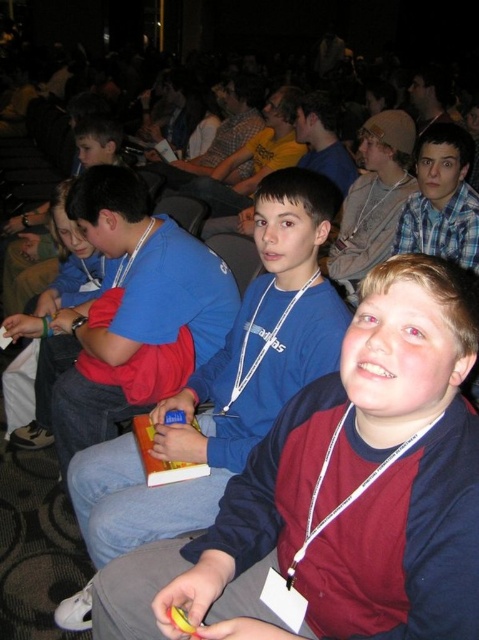
You are standing in the auditorium and want to take a photo of the point at coordinates point (305, 378). If your camera has a maximum focus range of 4 feet, will it be able to focus on that point?

The distance of point (305, 378) from the camera is 4.47 feet, which exceeds the camera maximum focus range of 4 feet. Therefore, the camera cannot focus on that point.

You are a photographer adjusting your camera settings. You need to ensure that both the blue fabric shirt at left and the blue denim jeans at center are in focus. Given their positions, which object is closer to the camera and might require adjusting the focus accordingly?

The blue fabric shirt at left is thinner than the blue denim jeans at center, so it is closer to the camera. Adjust the focus to prioritize the blue fabric shirt at left to ensure both are in focus.